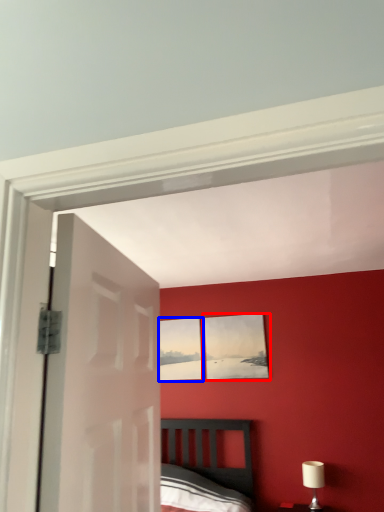
Question: Among these objects, which one is farthest to the camera, picture frame (highlighted by a red box) or picture frame (highlighted by a blue box)?

Choices:
 (A) picture frame
 (B) picture frame

Answer: (B)